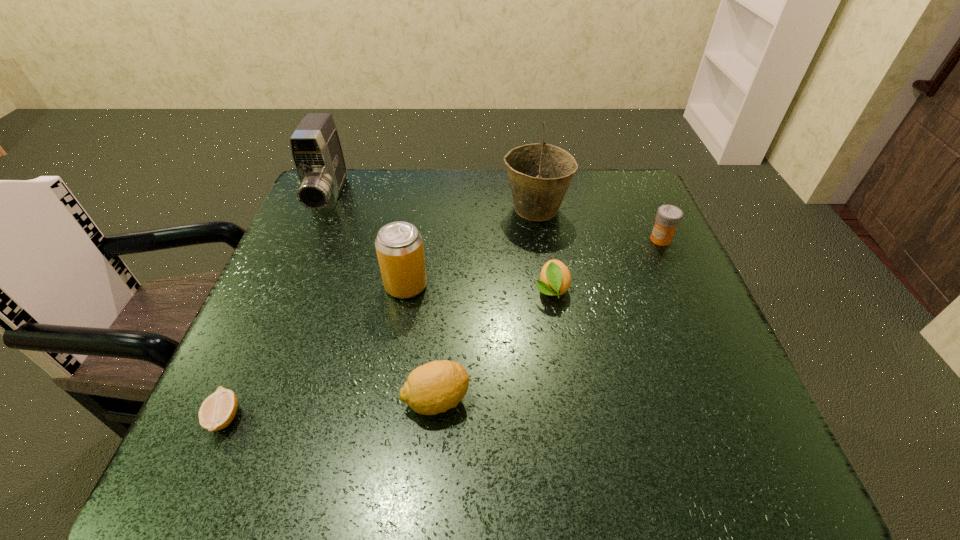
The height and width of the screenshot is (540, 960). In order to click on camcorder that is at the far edge in this screenshot , I will do `click(316, 150)`.

You are a GUI agent. You are given a task and a screenshot of the screen. Output one action in this format:
    pyautogui.click(x=<x>, y=<y>)
    Task: Click on the object present at the near edge
    This screenshot has height=540, width=960.
    Given the screenshot: What is the action you would take?
    pyautogui.click(x=218, y=410)

At what (x,y) coordinates should I click in order to perform the action: click on camcorder that is at the left edge. Please return your answer as a coordinate pair (x, y). The height and width of the screenshot is (540, 960). Looking at the image, I should click on (316, 150).

This screenshot has height=540, width=960. Find the location of `lemon at the left edge`. lemon at the left edge is located at coordinates (218, 410).

Find the location of `object that is at the right edge`. object that is at the right edge is located at coordinates (668, 217).

Locate an element on the screen. The width and height of the screenshot is (960, 540). object at the far left corner is located at coordinates (316, 150).

Identify the location of object that is at the near left corner. (218, 410).

Locate an element on the screen. This screenshot has width=960, height=540. vacant space at the far edge of the desktop is located at coordinates (421, 169).

Where is `free space at the near edge`? This screenshot has width=960, height=540. free space at the near edge is located at coordinates (506, 442).

Find the location of `free spot at the left edge of the desktop`. free spot at the left edge of the desktop is located at coordinates (337, 232).